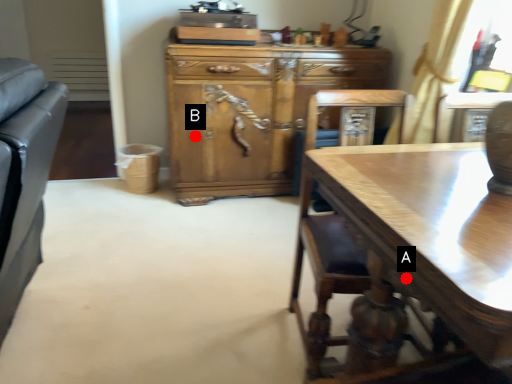
Question: Two points are circled on the image, labeled by A and B beside each circle. Which point appears closest to the camera in this image?

Choices:
 (A) A is closer
 (B) B is closer

Answer: (A)